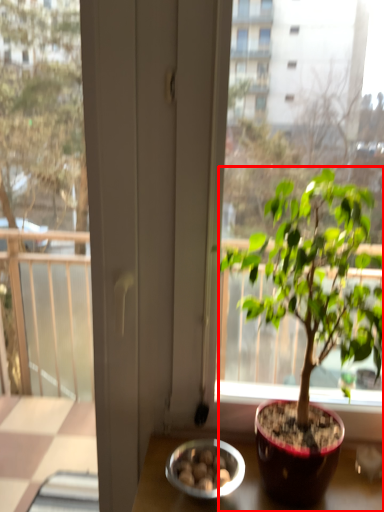
Question: From the image's perspective, what is the correct spatial relationship of houseplant (annotated by the red box) in relation to bowl?

Choices:
 (A) above
 (B) below

Answer: (A)